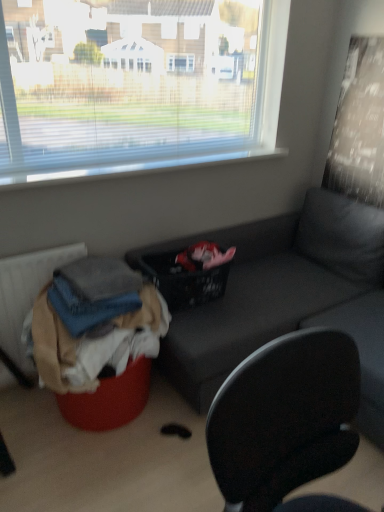
What do you see at coordinates (285, 297) in the screenshot?
I see `matte gray couch at center` at bounding box center [285, 297].

Where is `black woven basket at center`? The image size is (384, 512). black woven basket at center is located at coordinates (184, 280).

What do you see at coordinates (184, 280) in the screenshot? The image size is (384, 512). I see `black woven basket at center` at bounding box center [184, 280].

You are a GUI agent. You are given a task and a screenshot of the screen. Output one action in this format:
    pyautogui.click(x=<x>, y=<y>)
    Task: Click on the denim fabric at lower left, which is the second clothing in bottom-to-top order
    The height and width of the screenshot is (512, 384).
    Given the screenshot: What is the action you would take?
    pyautogui.click(x=87, y=307)

At what (x,y) coordinates should I click in order to perform the action: click on textured fabric radiator at lower left. Please return your answer as a coordinate pair (x, y). The width and height of the screenshot is (384, 512). Looking at the image, I should click on (26, 294).

Locate an element on the screen. matte gray couch at center is located at coordinates (285, 297).

Consider the image. From a real-world perspective, is denim fabric clothes at lower left, the second clothing positioned from the top, on black woven basket at center?

Incorrect, from a real-world perspective, denim fabric clothes at lower left, the second clothing positioned from the top, is lower than black woven basket at center.

Is black woven basket at center located within denim fabric clothes at lower left, placed as the 1th clothing when sorted from bottom to top?

No, denim fabric clothes at lower left, placed as the 1th clothing when sorted from bottom to top, does not contain black woven basket at center.

Which of these two, denim fabric clothes at lower left, the second clothing positioned from the top, or black woven basket at center, is thinner?

black woven basket at center is thinner.

Which is more to the left, denim fabric clothes at lower left, the second clothing positioned from the top, or black woven basket at center?

From the viewer's perspective, denim fabric clothes at lower left, the second clothing positioned from the top, appears more on the left side.

Is textured fabric radiator at lower left at the back of denim fabric clothes at lower left, the second clothing positioned from the top?

That's right, denim fabric clothes at lower left, the second clothing positioned from the top, is facing away from textured fabric radiator at lower left.

Does denim fabric clothes at lower left, the second clothing positioned from the top, have a smaller size compared to textured fabric radiator at lower left?

Incorrect, denim fabric clothes at lower left, the second clothing positioned from the top, is not smaller in size than textured fabric radiator at lower left.

Based on the photo, what's the angular difference between denim fabric clothes at lower left, the second clothing positioned from the top, and textured fabric radiator at lower left's facing directions?

They differ by 9.09 degrees in their facing directions.

Is denim fabric clothes at lower left, placed as the 1th clothing when sorted from bottom to top, taller or shorter than textured fabric radiator at lower left?

In the image, denim fabric clothes at lower left, placed as the 1th clothing when sorted from bottom to top, appears to be shorter than textured fabric radiator at lower left.

Can you confirm if matte gray couch at center is bigger than textured fabric radiator at lower left?

Correct, matte gray couch at center is larger in size than textured fabric radiator at lower left.

Visually, is matte gray couch at center positioned to the left or to the right of textured fabric radiator at lower left?

From the image, it's evident that matte gray couch at center is to the right of textured fabric radiator at lower left.

Measure the distance from matte gray couch at center to textured fabric radiator at lower left.

The distance of matte gray couch at center from textured fabric radiator at lower left is 39.24 inches.

From their relative heights in the image, would you say matte gray couch at center is taller or shorter than textured fabric radiator at lower left?

Considering their sizes, matte gray couch at center has more height than textured fabric radiator at lower left.

Does matte gray couch at center come in front of denim fabric clothes at lower left, the second clothing positioned from the top?

That is False.

Considering the sizes of objects matte gray couch at center and denim fabric clothes at lower left, placed as the 1th clothing when sorted from bottom to top, in the image provided, who is smaller, matte gray couch at center or denim fabric clothes at lower left, placed as the 1th clothing when sorted from bottom to top,?

Smaller between the two is denim fabric clothes at lower left, placed as the 1th clothing when sorted from bottom to top.

Locate an element on the screen. The width and height of the screenshot is (384, 512). clothing that is the 2nd one when counting downward from the matte gray couch at center (from the image's perspective) is located at coordinates (94, 324).

Is matte gray couch at center spatially inside denim fabric clothes at lower left, placed as the 1th clothing when sorted from bottom to top, or outside of it?

The correct answer is: outside.

In the scene shown: Is matte gray couch at center bigger than denim fabric at lower left, which is the second clothing in bottom-to-top order?

Yes, matte gray couch at center is bigger than denim fabric at lower left, which is the second clothing in bottom-to-top order.

In the scene shown: Which is more to the left, matte gray couch at center or denim fabric at lower left, which is the second clothing in bottom-to-top order?

From the viewer's perspective, denim fabric at lower left, which is the second clothing in bottom-to-top order, appears more on the left side.

Locate an element on the screen. the 2nd clothing directly above the matte gray couch at center (from a real-world perspective) is located at coordinates (87, 307).

Does denim fabric at lower left, the first clothing viewed from the top, have a larger size compared to matte gray couch at center?

No.

Does point (99, 324) lie behind point (229, 342)?

That is False.

You are a GUI agent. You are given a task and a screenshot of the screen. Output one action in this format:
    pyautogui.click(x=<x>, y=<y>)
    Task: Click on the studio couch that appears in front of the denim fabric at lower left, which is the second clothing in bottom-to-top order
    
    Given the screenshot: What is the action you would take?
    pyautogui.click(x=285, y=297)

From a real-world perspective, which object rests below the other?

matte gray couch at center.

You are a GUI agent. You are given a task and a screenshot of the screen. Output one action in this format:
    pyautogui.click(x=<x>, y=<y>)
    Task: Click on the basket above the matte gray couch at center (from a real-world perspective)
    The height and width of the screenshot is (512, 384).
    Given the screenshot: What is the action you would take?
    pyautogui.click(x=184, y=280)

Who is taller, matte gray couch at center or black woven basket at center?

Standing taller between the two is matte gray couch at center.

Considering the relative sizes of matte gray couch at center and black woven basket at center in the image provided, is matte gray couch at center bigger than black woven basket at center?

Indeed, matte gray couch at center has a larger size compared to black woven basket at center.

The image size is (384, 512). I want to click on basket behind the denim fabric clothes at lower left, the second clothing positioned from the top, so click(x=184, y=280).

At what (x,y) coordinates should I click in order to perform the action: click on radiator above the denim fabric clothes at lower left, the second clothing positioned from the top (from the image's perspective). Please return your answer as a coordinate pair (x, y). Looking at the image, I should click on (26, 294).

Considering their positions, is textured fabric radiator at lower left positioned closer to matte gray couch at center than denim fabric at lower left, which is the second clothing in bottom-to-top order?

denim fabric at lower left, which is the second clothing in bottom-to-top order, is closer to matte gray couch at center.

Looking at the image, which one is located closer to denim fabric at lower left, the first clothing viewed from the top, denim fabric clothes at lower left, the second clothing positioned from the top, or textured fabric radiator at lower left?

denim fabric clothes at lower left, the second clothing positioned from the top, is closer to denim fabric at lower left, the first clothing viewed from the top.

Considering their positions, is textured fabric radiator at lower left positioned closer to denim fabric at lower left, which is the second clothing in bottom-to-top order, than black woven basket at center?

black woven basket at center.

Based on their spatial positions, is black woven basket at center or matte gray couch at center further from textured fabric radiator at lower left?

The object further to textured fabric radiator at lower left is matte gray couch at center.

When comparing their distances from matte gray couch at center, does denim fabric at lower left, which is the second clothing in bottom-to-top order, or denim fabric clothes at lower left, placed as the 1th clothing when sorted from bottom to top, seem further?

denim fabric at lower left, which is the second clothing in bottom-to-top order, lies further to matte gray couch at center than the other object.

Considering their positions, is textured fabric radiator at lower left positioned further to denim fabric at lower left, the first clothing viewed from the top, than matte gray couch at center?

matte gray couch at center is further to denim fabric at lower left, the first clothing viewed from the top.

Based on their spatial positions, is black woven basket at center or textured fabric radiator at lower left closer to denim fabric at lower left, the first clothing viewed from the top?

Based on the image, black woven basket at center appears to be nearer to denim fabric at lower left, the first clothing viewed from the top.

Which object lies further to the anchor point textured fabric radiator at lower left, matte gray couch at center or black woven basket at center?

matte gray couch at center is further to textured fabric radiator at lower left.

Locate an element on the screen. This screenshot has height=512, width=384. basket located between denim fabric clothes at lower left, the second clothing positioned from the top, and matte gray couch at center in the left-right direction is located at coordinates (184, 280).

You are a GUI agent. You are given a task and a screenshot of the screen. Output one action in this format:
    pyautogui.click(x=<x>, y=<y>)
    Task: Click on the clothing between denim fabric at lower left, the first clothing viewed from the top, and matte gray couch at center, in the horizontal direction
    This screenshot has width=384, height=512.
    Given the screenshot: What is the action you would take?
    pyautogui.click(x=94, y=324)

This screenshot has width=384, height=512. I want to click on basket between denim fabric at lower left, which is the second clothing in bottom-to-top order, and matte gray couch at center from left to right, so click(184, 280).

Locate an element on the screen. basket between textured fabric radiator at lower left and matte gray couch at center is located at coordinates (184, 280).